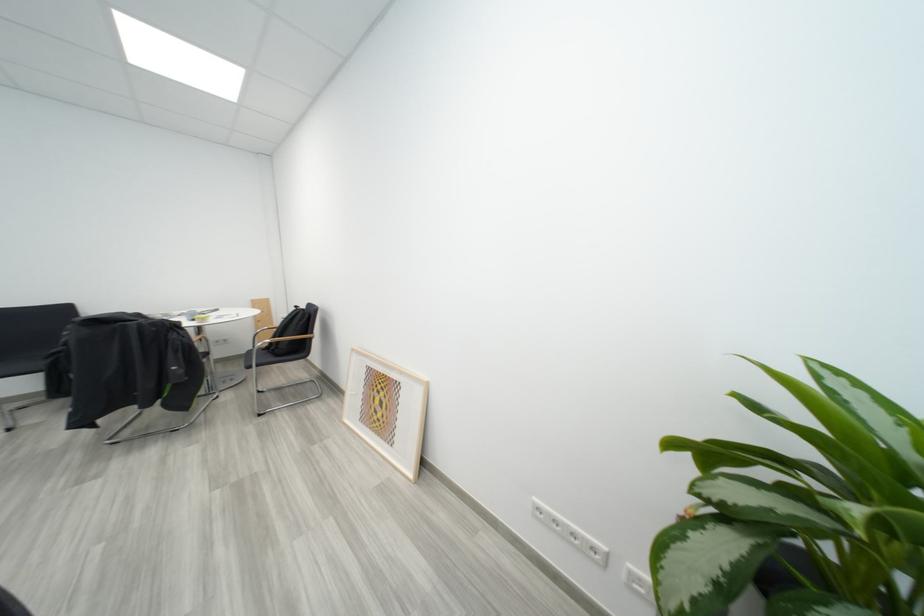
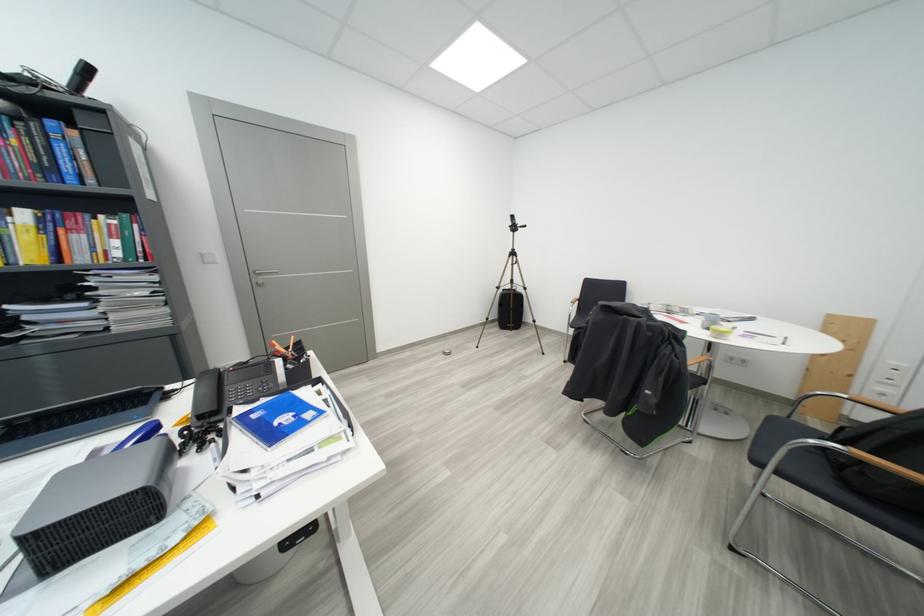
Where in the second image is the point corresponding to point (258, 370) from the first image?

(767, 466)